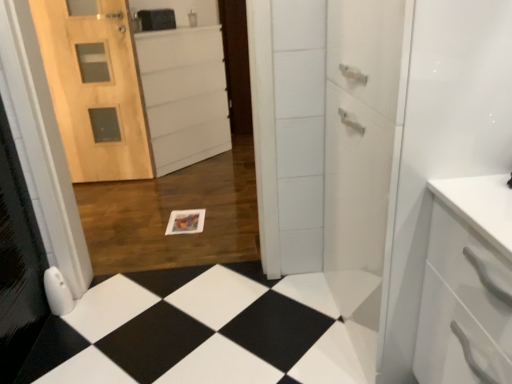
Question: Can you confirm if white matte cabinet at center is positioned to the right of natural wood door at left?

Choices:
 (A) yes
 (B) no

Answer: (A)

Question: Is white matte cabinet at center not inside natural wood door at left?

Choices:
 (A) yes
 (B) no

Answer: (A)

Question: Can you confirm if white matte cabinet at center is smaller than natural wood door at left?

Choices:
 (A) yes
 (B) no

Answer: (B)

Question: Can you confirm if white matte cabinet at center is thinner than natural wood door at left?

Choices:
 (A) yes
 (B) no

Answer: (B)

Question: Is white matte cabinet at center shorter than natural wood door at left?

Choices:
 (A) no
 (B) yes

Answer: (B)

Question: Is black glossy tile at lower center in front of or behind white matte cabinet at center in the image?

Choices:
 (A) behind
 (B) front

Answer: (B)

Question: From the image's perspective, relative to white matte cabinet at center, is black glossy tile at lower center above or below?

Choices:
 (A) below
 (B) above

Answer: (A)

Question: Is black glossy tile at lower center inside the boundaries of white matte cabinet at center, or outside?

Choices:
 (A) inside
 (B) outside

Answer: (B)

Question: Would you say black glossy tile at lower center is to the left or to the right of white matte cabinet at center in the picture?

Choices:
 (A) left
 (B) right

Answer: (B)

Question: Is natural wood door at left taller or shorter than black glossy tile at lower center?

Choices:
 (A) tall
 (B) short

Answer: (A)

Question: From the image's perspective, is natural wood door at left positioned above or below black glossy tile at lower center?

Choices:
 (A) below
 (B) above

Answer: (B)

Question: Considering the relative positions of natural wood door at left and black glossy tile at lower center in the image provided, is natural wood door at left to the left or to the right of black glossy tile at lower center?

Choices:
 (A) right
 (B) left

Answer: (B)

Question: Do you think natural wood door at left is within black glossy tile at lower center, or outside of it?

Choices:
 (A) inside
 (B) outside

Answer: (B)

Question: Is white matte cabinet at center taller or shorter than black glossy tile at lower center?

Choices:
 (A) tall
 (B) short

Answer: (A)

Question: Considering their positions, is white matte cabinet at center located in front of or behind black glossy tile at lower center?

Choices:
 (A) behind
 (B) front

Answer: (A)